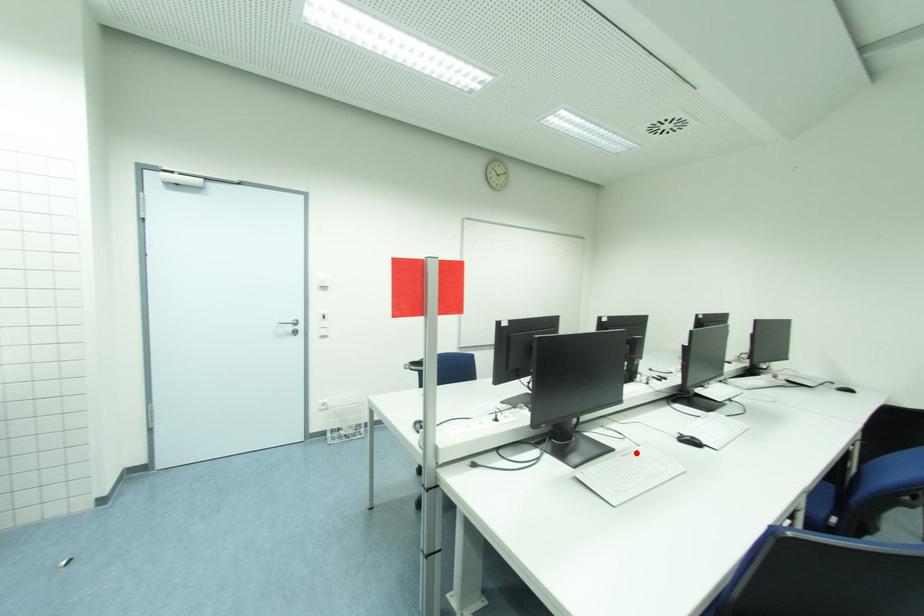
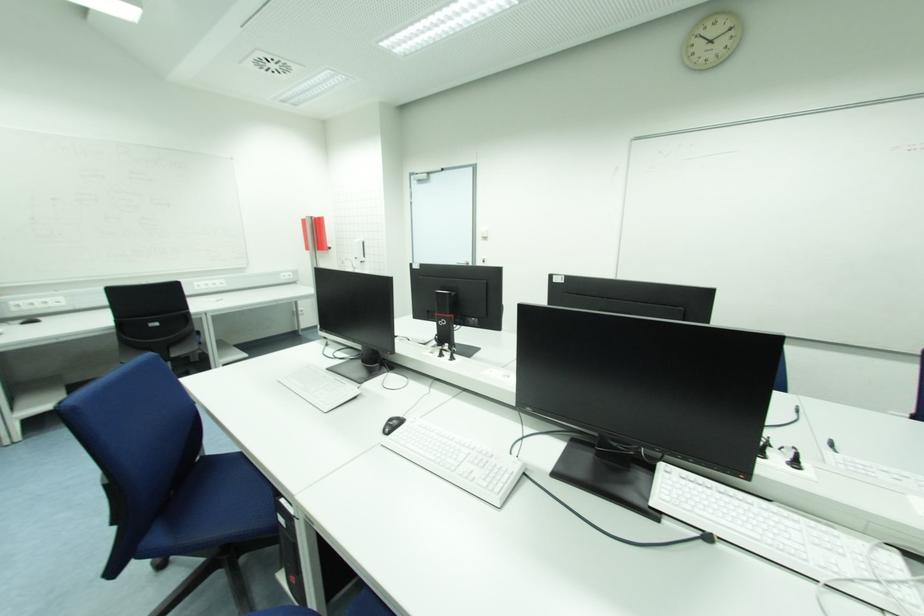
Where in the second image is the point corresponding to the highlighted location from the first image?

(347, 386)